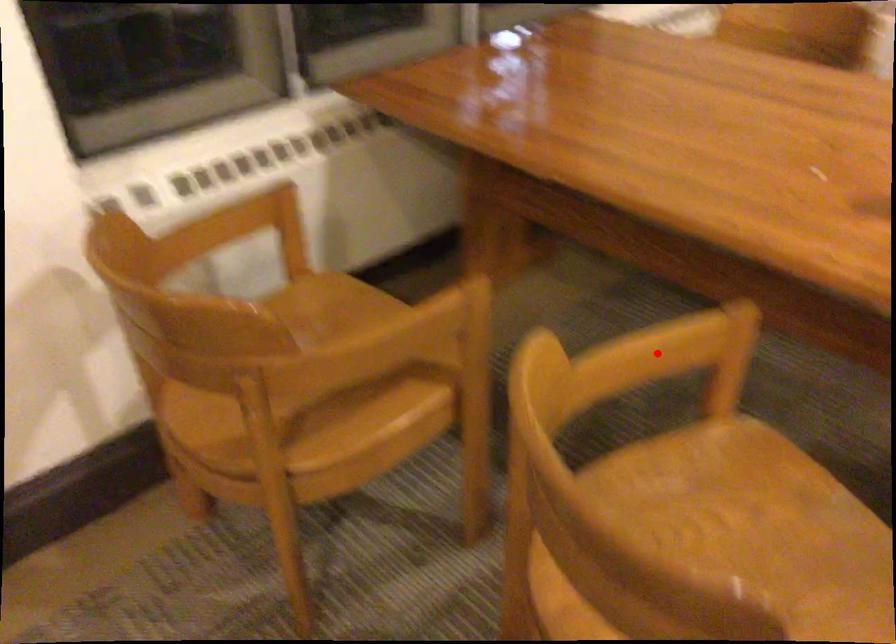
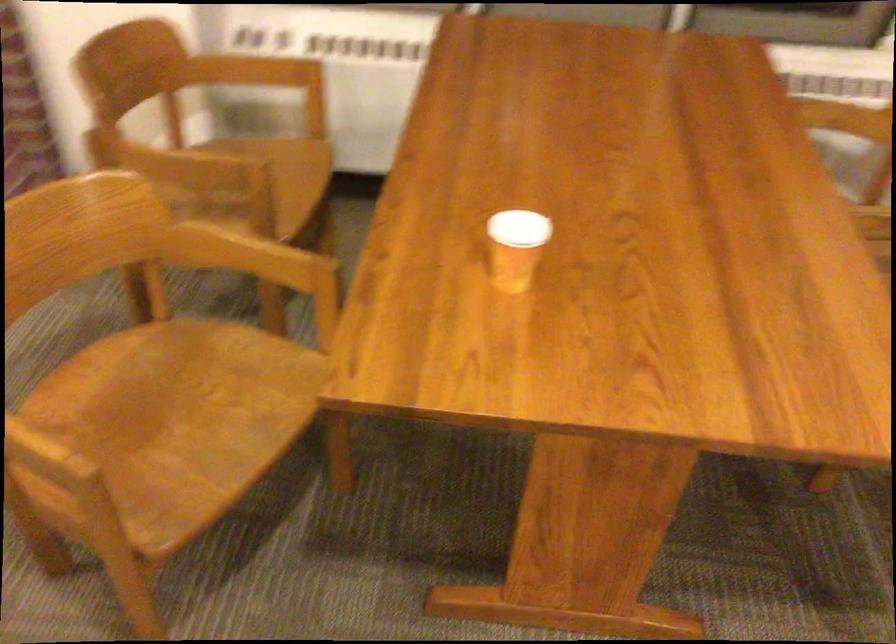
Question: I am providing you with two images of the same scene from different viewpoints. Image1 has a red point marked. In image2, the corresponding 3D location appears at what relative position? Reply with the corresponding letter.

Choices:
 (A) Closer
 (B) Farther

Answer: (B)